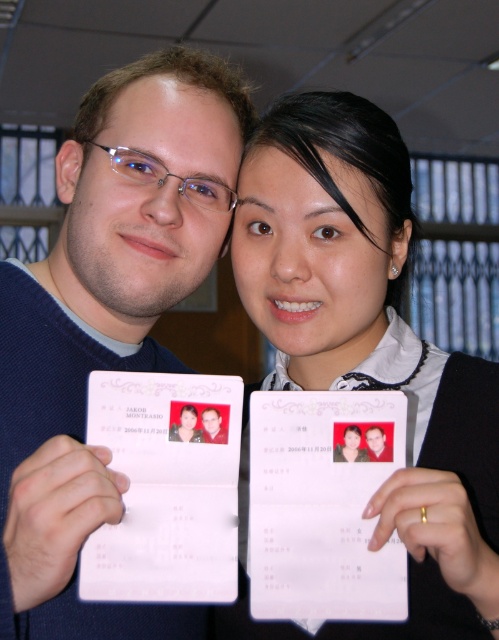
Between white paper at center and matte white id card at center, which one is positioned lower?

matte white id card at center

Can you confirm if white paper at center is thinner than matte white id card at center?

No.

Identify the location of white paper at center. The width and height of the screenshot is (499, 640). (371, 340).

Who is positioned more to the left, matte pink passport at center or matte white id card at center?

matte white id card at center

Which is behind, point (348, 436) or point (178, 440)?

The point (348, 436) is behind.

The width and height of the screenshot is (499, 640). What are the coordinates of `matte pink passport at center` in the screenshot? It's located at (350, 445).

Is white paper at center positioned in front of white paper calendar at center?

That is True.

Does point (340, 104) come closer to viewer compared to point (398, 461)?

No, (340, 104) is further to viewer.

Is point (317, 188) positioned behind point (274, 541)?

That is True.

Where is `white paper at center`? The image size is (499, 640). white paper at center is located at coordinates (371, 340).